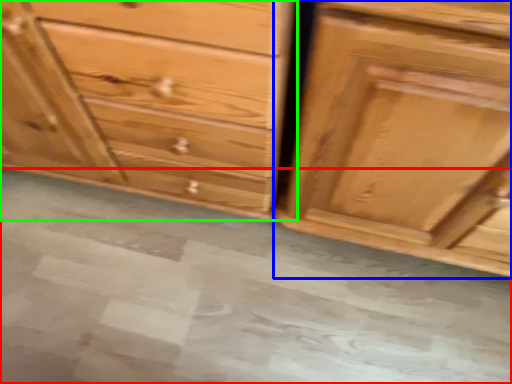
Question: Which is nearer to the concrete (highlighted by a red box)? chest of drawers (highlighted by a blue box) or chest of drawers (highlighted by a green box).

Choices:
 (A) chest of drawers
 (B) chest of drawers

Answer: (B)